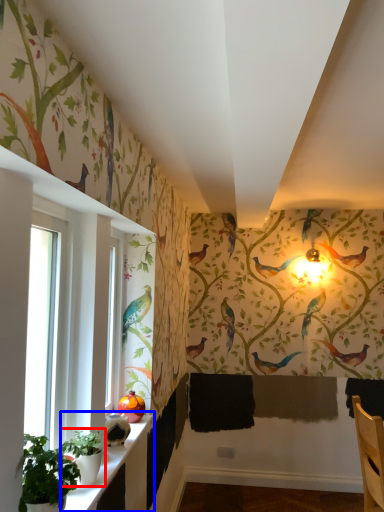
Question: Among these objects, which one is nearest to the camera, plant (highlighted by a red box) or window sill (highlighted by a blue box)?

Choices:
 (A) plant
 (B) window sill

Answer: (B)